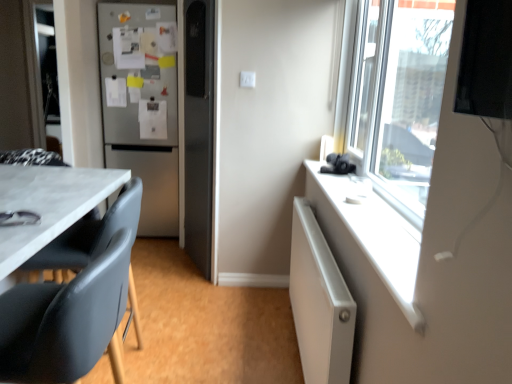
What do you see at coordinates (247, 79) in the screenshot? I see `white plastic electric outlet at center` at bounding box center [247, 79].

Measure the distance between white plastic electric outlet at center and camera.

8.34 feet.

What do you see at coordinates (142, 104) in the screenshot? The image size is (512, 384). I see `satin silver refrigerator at left` at bounding box center [142, 104].

At what (x,y) coordinates should I click in order to perform the action: click on black plastic swivel chair at left. Please return your answer as a coordinate pair (x, y). Image resolution: width=512 pixels, height=384 pixels. Looking at the image, I should click on (91, 234).

The width and height of the screenshot is (512, 384). What do you see at coordinates (319, 302) in the screenshot?
I see `white textured radiator at right` at bounding box center [319, 302].

What are the coordinates of `white plastic electric outlet at center` in the screenshot? It's located at (247, 79).

From the image's perspective, which one is positioned higher, white plastic window sill at upper right or black plastic swivel chair at left?

white plastic window sill at upper right.

Is white plastic window sill at upper right next to black plastic swivel chair at left?

No.

Who is bigger, white plastic window sill at upper right or black plastic swivel chair at left?

Bigger between the two is black plastic swivel chair at left.

Is white plastic window sill at upper right inside the boundaries of black plastic swivel chair at left, or outside?

white plastic window sill at upper right cannot be found inside black plastic swivel chair at left.

From the image's perspective, which object appears higher, black leather chair at lower left or white plastic window sill at upper right?

white plastic window sill at upper right.

Which is more to the left, black leather chair at lower left or white plastic window sill at upper right?

Positioned to the left is black leather chair at lower left.

Does point (116, 269) come farther from viewer compared to point (362, 276)?

No, it is in front of (362, 276).

Is black leather chair at lower left wider than white plastic window sill at upper right?

Indeed, black leather chair at lower left has a greater width compared to white plastic window sill at upper right.

How different are the orientations of white textured radiator at right and satin silver refrigerator at left in degrees?

The angle between the facing direction of white textured radiator at right and the facing direction of satin silver refrigerator at left is 90 degrees.

Locate an element on the screen. This screenshot has height=384, width=512. cabinetry below the satin silver refrigerator at left (from a real-world perspective) is located at coordinates (319, 302).

From the image's perspective, is white textured radiator at right located beneath satin silver refrigerator at left?

Yes.

Which of these two, white textured radiator at right or satin silver refrigerator at left, is smaller?

white textured radiator at right.

Measure the distance from white plastic electric outlet at center to black plastic swivel chair at left.

white plastic electric outlet at center and black plastic swivel chair at left are 1.25 meters apart.

Considering the sizes of white plastic electric outlet at center and black plastic swivel chair at left in the image, is white plastic electric outlet at center bigger or smaller than black plastic swivel chair at left?

Clearly, white plastic electric outlet at center is smaller in size than black plastic swivel chair at left.

Considering the positions of objects white plastic electric outlet at center and black plastic swivel chair at left in the image provided, who is more to the left, white plastic electric outlet at center or black plastic swivel chair at left?

black plastic swivel chair at left is more to the left.

At what (x,y) coordinates should I click in order to perform the action: click on cabinetry below the black leather chair at lower left (from a real-world perspective). Please return your answer as a coordinate pair (x, y). This screenshot has width=512, height=384. Looking at the image, I should click on (319, 302).

Looking at this image, looking at the image, does white textured radiator at right seem bigger or smaller compared to black leather chair at lower left?

Clearly, white textured radiator at right is smaller in size than black leather chair at lower left.

Is white textured radiator at right oriented away from black leather chair at lower left?

No, white textured radiator at right is not facing the opposite direction of black leather chair at lower left.

Locate an element on the screen. The height and width of the screenshot is (384, 512). electric outlet on the right of satin silver refrigerator at left is located at coordinates (247, 79).

In the scene shown: How many degrees apart are the facing directions of white plastic electric outlet at center and satin silver refrigerator at left?

There is a 0.729-degree angle between the facing directions of white plastic electric outlet at center and satin silver refrigerator at left.

Who is bigger, white plastic electric outlet at center or satin silver refrigerator at left?

satin silver refrigerator at left is bigger.

Is point (249, 87) farther from viewer compared to point (176, 163)?

No.

From the picture: From a real-world perspective, is black leather chair at lower left positioned above or below black plastic swivel chair at left?

black leather chair at lower left is situated higher than black plastic swivel chair at left in the real world.

From the image's perspective, relative to black plastic swivel chair at left, is black leather chair at lower left above or below?

black leather chair at lower left is above black plastic swivel chair at left.

Is black leather chair at lower left in contact with black plastic swivel chair at left?

No, black leather chair at lower left is not making contact with black plastic swivel chair at left.

This screenshot has width=512, height=384. Identify the location of swivel chair directly beneath the white plastic window sill at upper right (from a real-world perspective). (91, 234).

In order to click on window sill in front of the black leather chair at lower left in this screenshot , I will do `click(367, 241)`.

Based on their spatial positions, is white plastic electric outlet at center or black plastic swivel chair at left closer to white textured radiator at right?

Among the two, black plastic swivel chair at left is located nearer to white textured radiator at right.

Looking at the image, which one is located further to black plastic swivel chair at left, white textured radiator at right or white plastic window sill at upper right?

white plastic window sill at upper right.

Based on the photo, when comparing their distances from black plastic swivel chair at left, does white textured radiator at right or satin silver refrigerator at left seem closer?

white textured radiator at right is positioned closer to the anchor black plastic swivel chair at left.

Based on their spatial positions, is black plastic swivel chair at left or white textured radiator at right further from black leather chair at lower left?

white textured radiator at right lies further to black leather chair at lower left than the other object.

Estimate the real-world distances between objects in this image. Which object is further from black plastic swivel chair at left, white textured radiator at right or black leather chair at lower left?

Based on the image, white textured radiator at right appears to be further to black plastic swivel chair at left.

Looking at the image, which one is located closer to white plastic electric outlet at center, white textured radiator at right or white plastic window sill at upper right?

Among the two, white plastic window sill at upper right is located nearer to white plastic electric outlet at center.

Considering their positions, is white textured radiator at right positioned further to white plastic electric outlet at center than black leather chair at lower left?

black leather chair at lower left.

From the picture: When comparing their distances from white plastic electric outlet at center, does black leather chair at lower left or satin silver refrigerator at left seem further?

black leather chair at lower left is positioned further to the anchor white plastic electric outlet at center.

Locate an element on the screen. The height and width of the screenshot is (384, 512). chair positioned between white plastic window sill at upper right and white plastic electric outlet at center from near to far is located at coordinates (63, 320).

Where is `swivel chair located between white plastic window sill at upper right and white plastic electric outlet at center in the depth direction`? swivel chair located between white plastic window sill at upper right and white plastic electric outlet at center in the depth direction is located at coordinates (91, 234).

Identify the location of cabinetry positioned between black leather chair at lower left and white plastic electric outlet at center from near to far. Image resolution: width=512 pixels, height=384 pixels. (319, 302).

This screenshot has width=512, height=384. I want to click on swivel chair located between black leather chair at lower left and white plastic electric outlet at center in the depth direction, so click(91, 234).